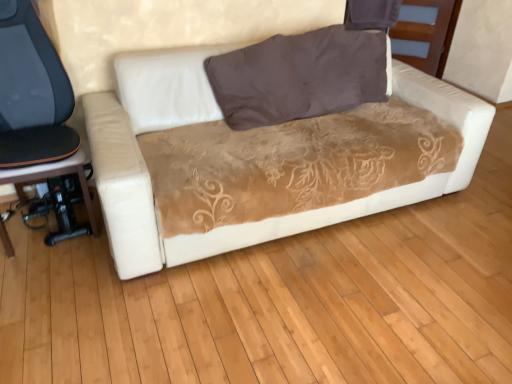
Identify the location of vacant area that is in front of black plastic music stool at lower left. (48, 259).